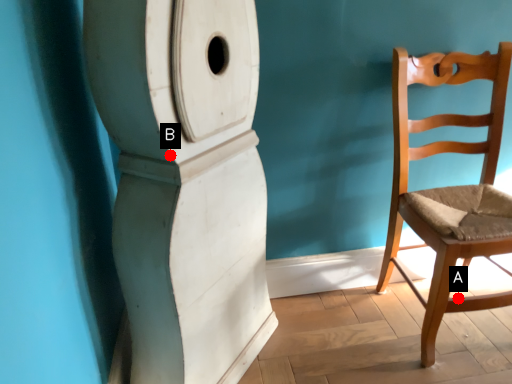
Question: Two points are circled on the image, labeled by A and B beside each circle. Which point is further to the camera?

Choices:
 (A) A is further
 (B) B is further

Answer: (A)